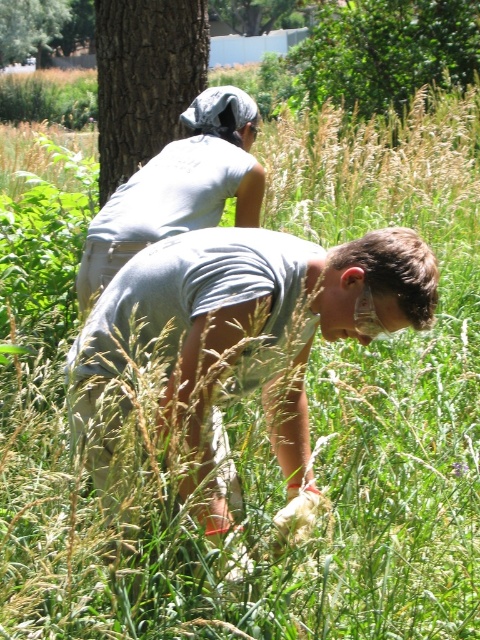
Question: Is green leafy tree at upper center positioned at the back of brown rough tree at upper left?

Choices:
 (A) yes
 (B) no

Answer: (A)

Question: Estimate the real-world distances between objects in this image. Which object is farther from the green leafy tree at upper center?

Choices:
 (A) brown rough tree at upper left
 (B) gray matte shirt at upper center
 (C) brown rough tree trunk at upper left

Answer: (C)

Question: Which object appears farthest from the camera in this image?

Choices:
 (A) green leafy tree at upper center
 (B) brown rough tree trunk at upper left
 (C) brown rough tree at upper left

Answer: (B)

Question: From the image, what is the correct spatial relationship of gray matte shirt at upper center in relation to brown rough tree trunk at upper left?

Choices:
 (A) right
 (B) left

Answer: (A)

Question: Can you confirm if gray matte shirt at upper center is positioned above brown rough tree at upper left?

Choices:
 (A) yes
 (B) no

Answer: (B)

Question: Which object appears farthest from the camera in this image?

Choices:
 (A) gray matte shirt at upper center
 (B) green leafy tree at upper center
 (C) brown rough tree trunk at upper left

Answer: (C)